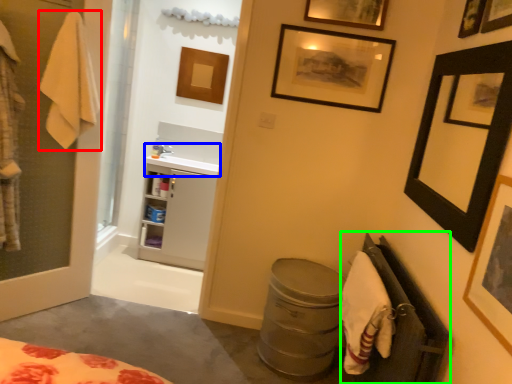
Question: Which object is positioned closest to bath towel (highlighted by a red box)? Select from sink (highlighted by a blue box) and closet (highlighted by a green box).

Choices:
 (A) sink
 (B) closet

Answer: (A)